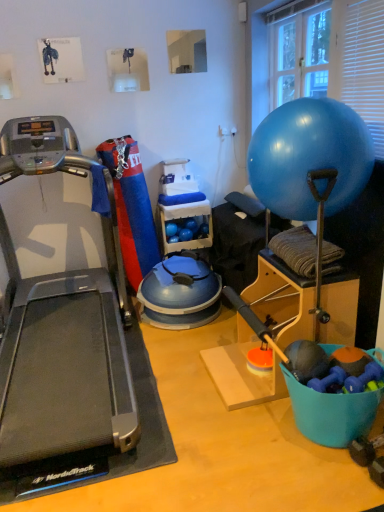
Question: Would you say silver/black treadmill at left is outside blue plastic bucket at lower right?

Choices:
 (A) no
 (B) yes

Answer: (B)

Question: Can you confirm if silver/black treadmill at left is positioned to the left of blue plastic bucket at lower right?

Choices:
 (A) yes
 (B) no

Answer: (A)

Question: Is silver/black treadmill at left positioned before blue plastic bucket at lower right?

Choices:
 (A) no
 (B) yes

Answer: (B)

Question: From a real-world perspective, is silver/black treadmill at left positioned under blue plastic bucket at lower right based on gravity?

Choices:
 (A) yes
 (B) no

Answer: (B)

Question: Does silver/black treadmill at left appear on the right side of blue plastic bucket at lower right?

Choices:
 (A) no
 (B) yes

Answer: (A)

Question: Does silver/black treadmill at left touch blue plastic bucket at lower right?

Choices:
 (A) no
 (B) yes

Answer: (A)

Question: From the image's perspective, is blue plastic bucket at lower right above transparent glass window at upper right?

Choices:
 (A) yes
 (B) no

Answer: (B)

Question: Does blue plastic bucket at lower right come behind transparent glass window at upper right?

Choices:
 (A) yes
 (B) no

Answer: (B)

Question: Is blue plastic bucket at lower right turned away from transparent glass window at upper right?

Choices:
 (A) yes
 (B) no

Answer: (B)

Question: Is the depth of blue plastic bucket at lower right less than that of transparent glass window at upper right?

Choices:
 (A) no
 (B) yes

Answer: (B)

Question: Can you confirm if blue plastic bucket at lower right is thinner than transparent glass window at upper right?

Choices:
 (A) yes
 (B) no

Answer: (B)

Question: Is blue plastic bucket at lower right next to transparent glass window at upper right?

Choices:
 (A) no
 (B) yes

Answer: (A)

Question: Does transparent glass window at upper right come behind blue plastic bucket at lower right?

Choices:
 (A) no
 (B) yes

Answer: (B)